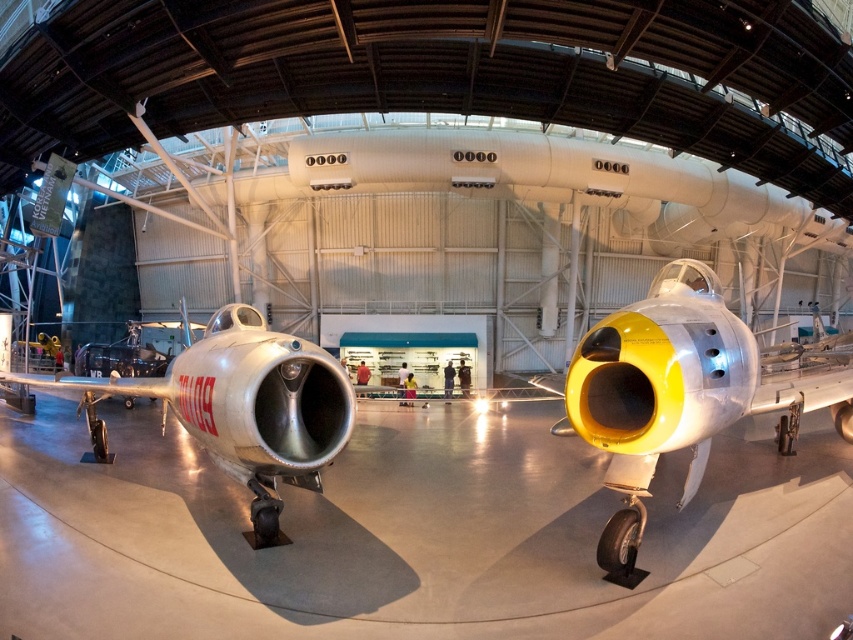
Can you confirm if yellow matte jet engine at center is thinner than silver metallic airplane at center?

Yes.

Where is `yellow matte jet engine at center`? yellow matte jet engine at center is located at coordinates (x=680, y=392).

I want to click on yellow matte jet engine at center, so click(680, 392).